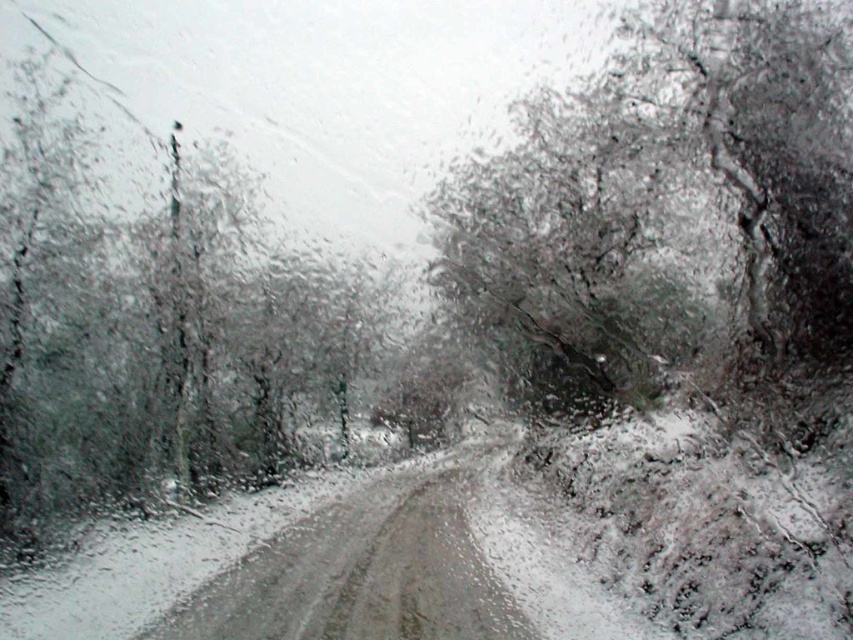
Question: Can you confirm if snowy bark tree at upper right is thinner than dark green textured tree at left?

Choices:
 (A) no
 (B) yes

Answer: (B)

Question: Which of the following is the closest to the observer?

Choices:
 (A) (776, 209)
 (B) (308, 374)

Answer: (A)

Question: Which point is closer to the camera?

Choices:
 (A) pos(77,196)
 (B) pos(659,19)

Answer: (B)

Question: Which point appears closest to the camera in this image?

Choices:
 (A) (207, 224)
 (B) (817, 136)

Answer: (B)

Question: Is snowy bark tree at upper right thinner than dark green textured tree at left?

Choices:
 (A) yes
 (B) no

Answer: (A)

Question: Can you confirm if snowy bark tree at upper right is wider than dark green textured tree at left?

Choices:
 (A) yes
 (B) no

Answer: (B)